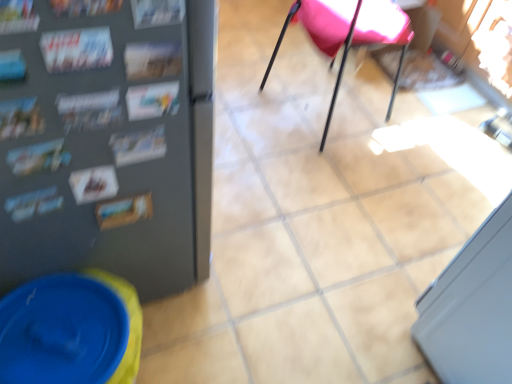
Where is `free space in front of pink fabric chair at center`? The height and width of the screenshot is (384, 512). free space in front of pink fabric chair at center is located at coordinates (328, 179).